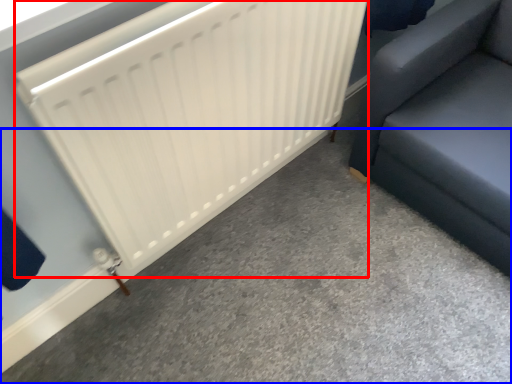
Question: Which of the following is the farthest to the observer, radiator (highlighted by a red box) or concrete (highlighted by a blue box)?

Choices:
 (A) radiator
 (B) concrete

Answer: (B)